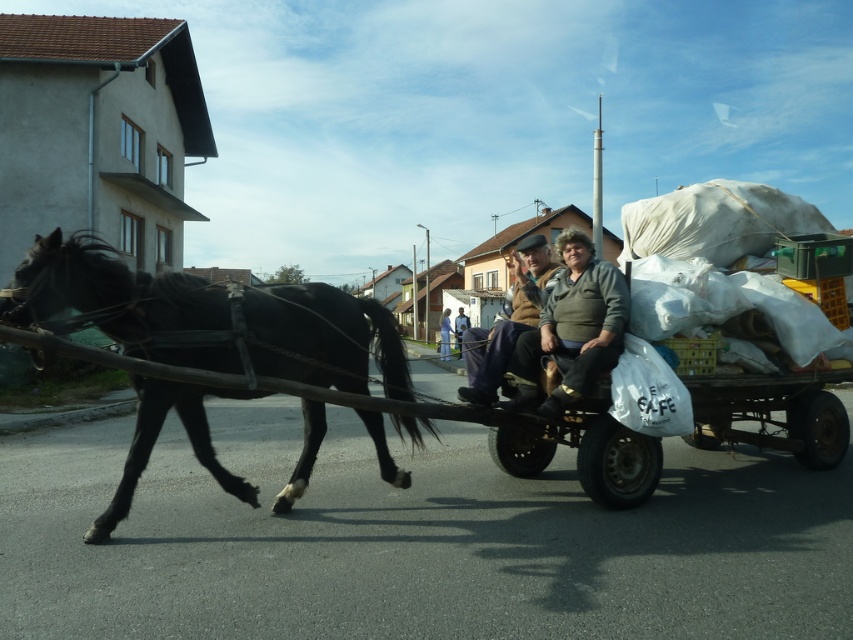
Question: Which object is closer to the camera taking this photo?

Choices:
 (A) black glossy horse at left
 (B) light blue fabric at center

Answer: (A)

Question: Which point is farther from the camera taking this photo?

Choices:
 (A) (448, 317)
 (B) (351, 390)

Answer: (A)

Question: Does black glossy horse at left appear on the left side of light blue fabric at center?

Choices:
 (A) no
 (B) yes

Answer: (B)

Question: Is black glossy horse at left smaller than light blue fabric at center?

Choices:
 (A) yes
 (B) no

Answer: (A)

Question: Can you confirm if black glossy horse at left is thinner than light blue fabric at center?

Choices:
 (A) no
 (B) yes

Answer: (A)